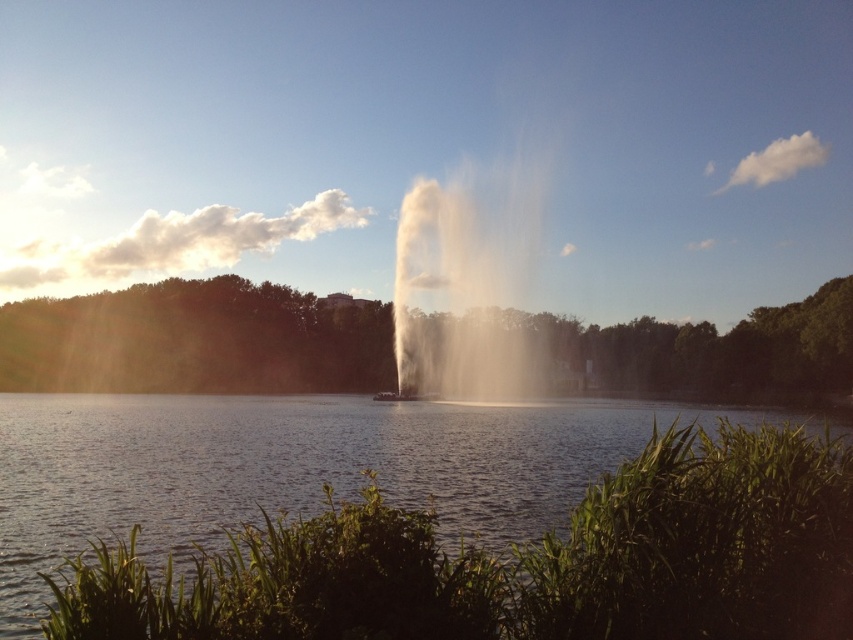
Question: Based on their relative distances, which object is farther from the green leafy tree at left?

Choices:
 (A) white misty fountain at center
 (B) transparent water at center

Answer: (B)

Question: Does transparent water at center have a larger size compared to white misty fountain at center?

Choices:
 (A) yes
 (B) no

Answer: (B)

Question: Which object is closer to the camera taking this photo?

Choices:
 (A) green leafy tree at left
 (B) white misty fountain at center

Answer: (B)

Question: From the image, what is the correct spatial relationship of transparent water at center in relation to white misty fountain at center?

Choices:
 (A) right
 (B) left

Answer: (B)

Question: Is transparent water at center below green leafy tree at left?

Choices:
 (A) no
 (B) yes

Answer: (B)

Question: Which object appears farthest from the camera in this image?

Choices:
 (A) white misty fountain at center
 (B) green leafy tree at left
 (C) transparent water at center

Answer: (B)